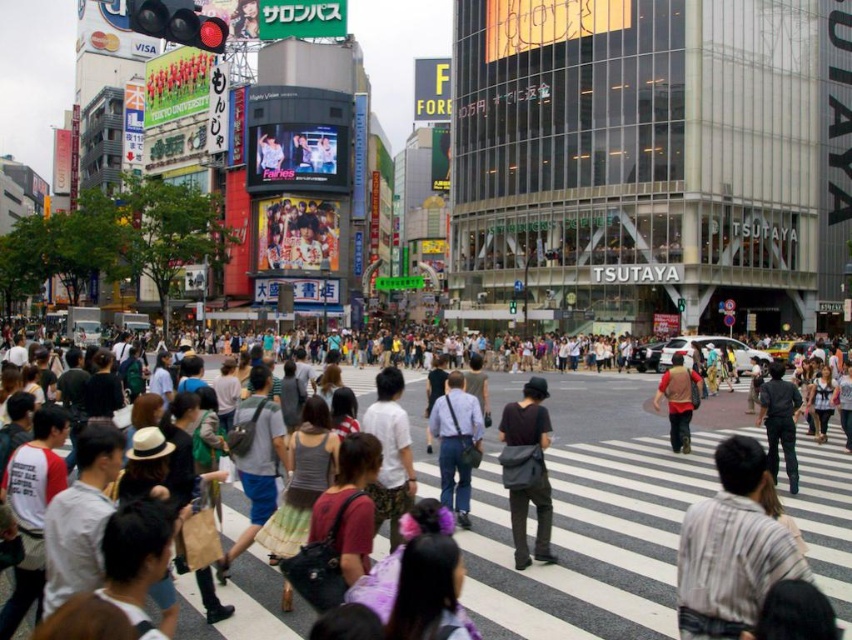
Question: Is striped shirt at center above white cotton t-shirt at lower left?

Choices:
 (A) yes
 (B) no

Answer: (B)

Question: Does white striped crosswalk at center appear over matte gray tank top at center?

Choices:
 (A) no
 (B) yes

Answer: (A)

Question: Which object appears closest to the camera in this image?

Choices:
 (A) dark gray fabric bag at center
 (B) matte blue jeans at center

Answer: (A)

Question: Considering the real-world distances, which object is closest to the striped shirt at center?

Choices:
 (A) white striped crosswalk at center
 (B) dark gray fabric jacket at center

Answer: (A)

Question: Is white cotton shirt at center further to the viewer compared to matte blue jeans at center?

Choices:
 (A) no
 (B) yes

Answer: (A)

Question: Which of the following is the farthest from the observer?

Choices:
 (A) red fabric jacket at center
 (B) white striped crosswalk at center

Answer: (A)